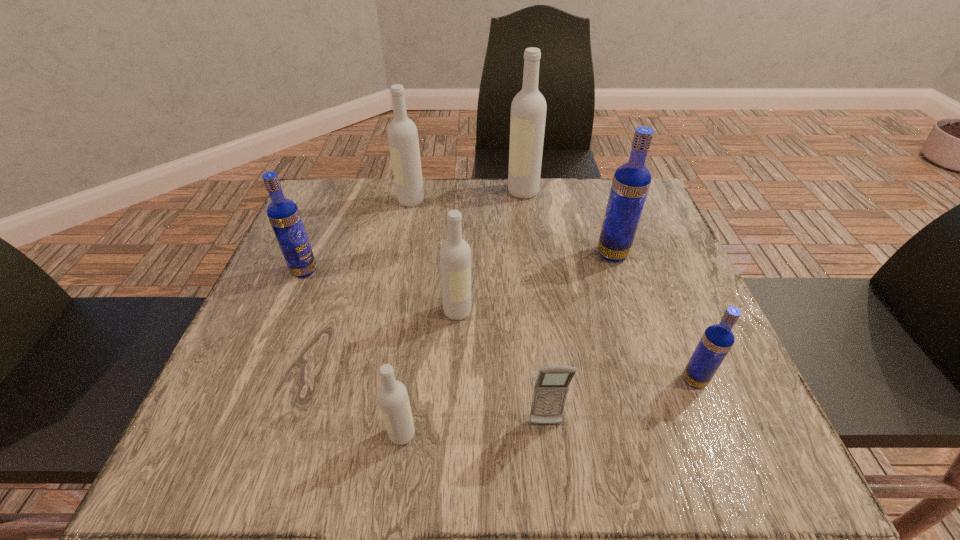
Identify the location of free space located 0.370m on the left of the rightmost object. The width and height of the screenshot is (960, 540). (469, 380).

This screenshot has height=540, width=960. Find the location of `blank area located on the back of the fifth vodka from right to left`. blank area located on the back of the fifth vodka from right to left is located at coordinates (410, 374).

Locate an element on the screen. blank space located 0.050m on the front-facing side of the cellular telephone is located at coordinates (550, 462).

The height and width of the screenshot is (540, 960). In order to click on vodka at the near edge in this screenshot , I will do `click(392, 396)`.

At what (x,y) coordinates should I click in order to perform the action: click on cellular telephone present at the near edge. Please return your answer as a coordinate pair (x, y). Looking at the image, I should click on (551, 387).

Identify the location of object that is at the left edge. (283, 214).

This screenshot has width=960, height=540. In the image, there is a desktop. Identify the location of vacant space at the far edge. (430, 180).

In the image, there is a desktop. Where is `free space at the near edge`? The image size is (960, 540). free space at the near edge is located at coordinates (586, 468).

At what (x,y) coordinates should I click in order to perform the action: click on free spot at the left edge of the desktop. Please return your answer as a coordinate pair (x, y). The height and width of the screenshot is (540, 960). Looking at the image, I should click on (324, 336).

In the image, there is a desktop. At what (x,y) coordinates should I click in order to perform the action: click on free space at the right edge. Please return your answer as a coordinate pair (x, y). Looking at the image, I should click on (719, 375).